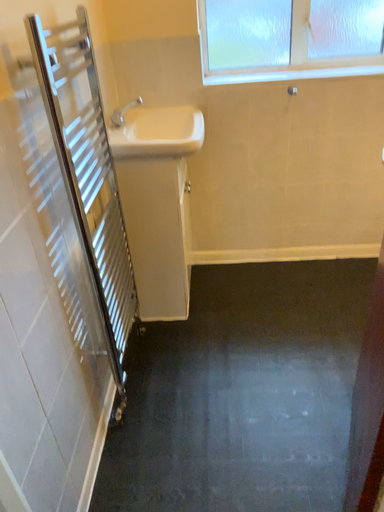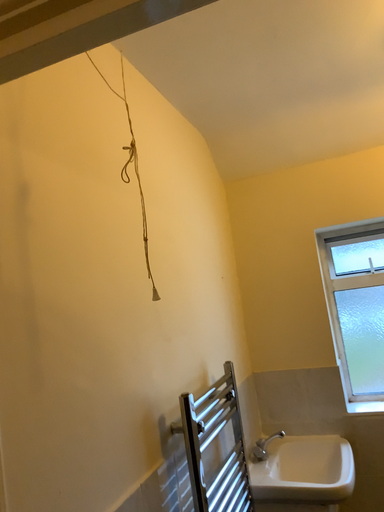
Question: How did the camera likely rotate when shooting the video?

Choices:
 (A) rotated left
 (B) rotated right

Answer: (A)